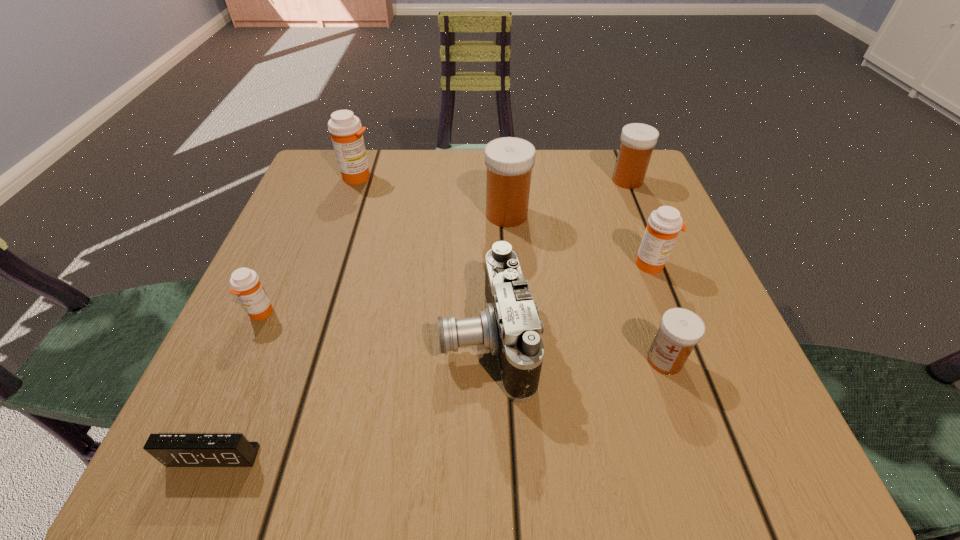
At what (x,y) coordinates should I click in order to perform the action: click on vacant space located at the lens of the camera. Please return your answer as a coordinate pair (x, y). This screenshot has height=540, width=960. Looking at the image, I should click on (300, 339).

At what (x,y) coordinates should I click in order to perform the action: click on free spot located on the front of the second nearest medicine. Please return your answer as a coordinate pair (x, y). The width and height of the screenshot is (960, 540). Looking at the image, I should click on (227, 390).

Locate an element on the screen. The width and height of the screenshot is (960, 540). free space located 0.200m on the left of the smallest white medicine is located at coordinates (514, 360).

The width and height of the screenshot is (960, 540). I want to click on object present at the near edge, so click(x=172, y=450).

The height and width of the screenshot is (540, 960). Find the location of `alarm clock present at the left edge`. alarm clock present at the left edge is located at coordinates (172, 450).

The height and width of the screenshot is (540, 960). What are the coordinates of `object that is at the far left corner` in the screenshot? It's located at (346, 130).

Locate an element on the screen. The image size is (960, 540). object present at the near left corner is located at coordinates (172, 450).

This screenshot has width=960, height=540. What are the coordinates of `object at the far right corner` in the screenshot? It's located at (637, 140).

At what (x,y) coordinates should I click in order to perform the action: click on vacant space at the far edge. Please return your answer as a coordinate pair (x, y). This screenshot has height=540, width=960. Looking at the image, I should click on (453, 173).

Identify the location of vacant point at the near edge. Image resolution: width=960 pixels, height=540 pixels. (509, 408).